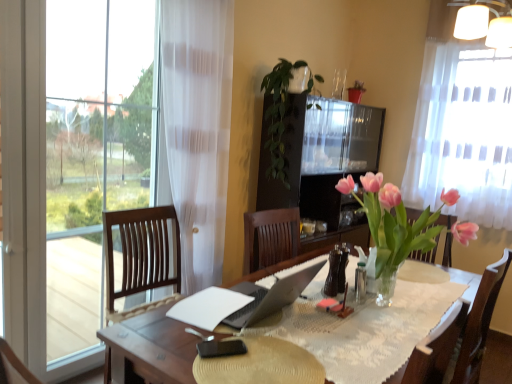
Question: From a real-world perspective, is white paper at center located higher than black matte phone at center?

Choices:
 (A) no
 (B) yes

Answer: (B)

Question: Is white paper at center thinner than black matte phone at center?

Choices:
 (A) no
 (B) yes

Answer: (B)

Question: Is white paper at center at the left side of black matte phone at center?

Choices:
 (A) no
 (B) yes

Answer: (B)

Question: Is white paper at center shorter than black matte phone at center?

Choices:
 (A) no
 (B) yes

Answer: (B)

Question: Is white paper at center behind black matte phone at center?

Choices:
 (A) yes
 (B) no

Answer: (A)

Question: Does white paper at center have a larger size compared to black matte phone at center?

Choices:
 (A) no
 (B) yes

Answer: (A)

Question: From a real-world perspective, does white matte lampshade at upper right sit lower than white sheer curtain at upper right?

Choices:
 (A) yes
 (B) no

Answer: (B)

Question: Does white matte lampshade at upper right appear on the right side of white sheer curtain at upper right?

Choices:
 (A) no
 (B) yes

Answer: (B)

Question: Is white matte lampshade at upper right behind white sheer curtain at upper right?

Choices:
 (A) no
 (B) yes

Answer: (B)

Question: Is white matte lampshade at upper right to the left of white sheer curtain at upper right from the viewer's perspective?

Choices:
 (A) no
 (B) yes

Answer: (A)

Question: Does white matte lampshade at upper right turn towards white sheer curtain at upper right?

Choices:
 (A) no
 (B) yes

Answer: (A)

Question: Is white matte lampshade at upper right placed right next to white sheer curtain at upper right?

Choices:
 (A) yes
 (B) no

Answer: (B)

Question: Considering the relative sizes of green leafy plant at center and white paper at center in the image provided, is green leafy plant at center bigger than white paper at center?

Choices:
 (A) no
 (B) yes

Answer: (B)